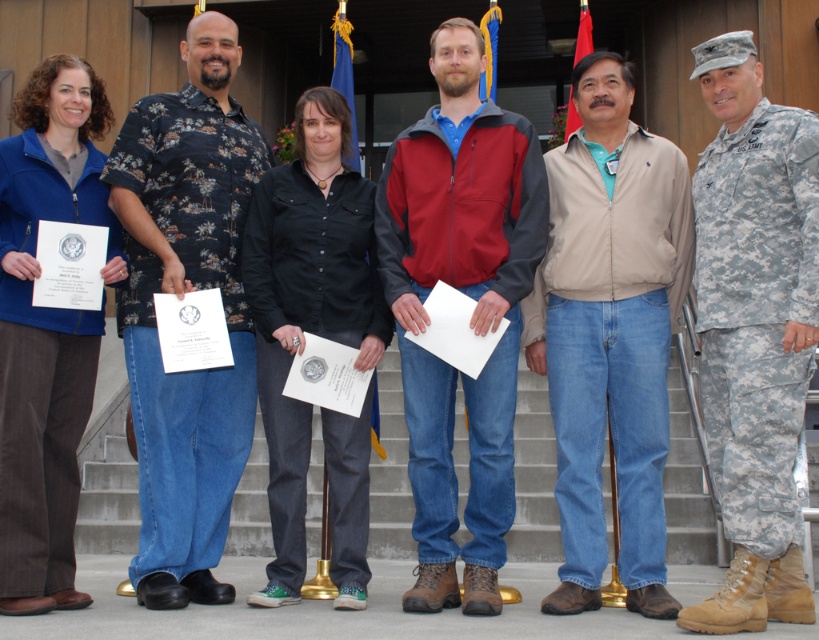
Question: Based on their relative distances, which object is nearer to the blue fleece jacket at left?

Choices:
 (A) floral shirt at center
 (B) black cotton shirt at center

Answer: (A)

Question: Can you confirm if camouflage fabric uniform at right is thinner than blue fleece jacket at left?

Choices:
 (A) yes
 (B) no

Answer: (A)

Question: From the image, what is the correct spatial relationship of beige cotton jacket at center in relation to floral shirt at center?

Choices:
 (A) left
 (B) right

Answer: (B)

Question: Which of the following is the closest to the observer?

Choices:
 (A) red-gray zip-up jacket at center
 (B) black cotton shirt at center

Answer: (A)

Question: Which object is closer to the camera taking this photo?

Choices:
 (A) red-gray zip-up jacket at center
 (B) beige cotton jacket at center

Answer: (B)

Question: Is camouflage fabric uniform at right to the left of black cotton shirt at center from the viewer's perspective?

Choices:
 (A) no
 (B) yes

Answer: (A)